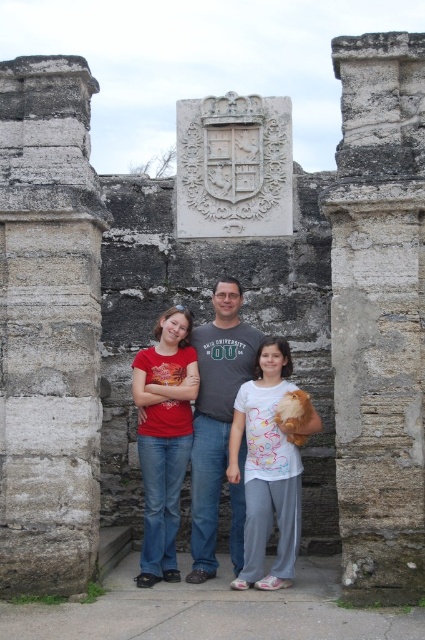
Question: Does matte red t-shirt at center appear over matte gray t-shirt at center?

Choices:
 (A) yes
 (B) no

Answer: (B)

Question: Which point is farther to the camera?

Choices:
 (A) matte gray stone family at center
 (B) gray stone pillar at center

Answer: (A)

Question: Which of the following is the farthest from the observer?

Choices:
 (A) gray stone pillar at center
 (B) matte gray stone family at center
 (C) matte gray t-shirt at center

Answer: (C)

Question: Can you confirm if white cotton shirt at center is positioned to the right of matte red t-shirt at center?

Choices:
 (A) no
 (B) yes

Answer: (B)

Question: Is white cotton shirt at center wider than matte gray stone family at center?

Choices:
 (A) yes
 (B) no

Answer: (B)

Question: Which object appears farthest from the camera in this image?

Choices:
 (A) matte red t-shirt at center
 (B) gray stone pillar at center
 (C) white cotton shirt at center

Answer: (A)